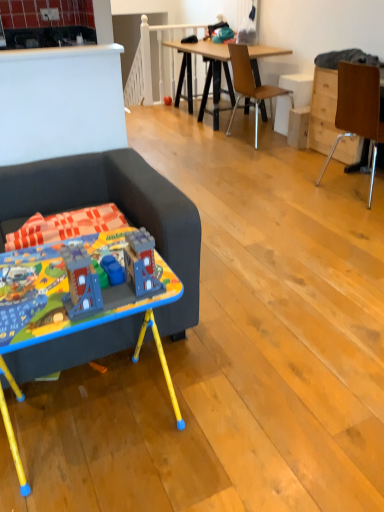
Where is `free space to the left of brown wooden chair at center, positioned as the 2th chair in front-to-back order`? free space to the left of brown wooden chair at center, positioned as the 2th chair in front-to-back order is located at coordinates (200, 139).